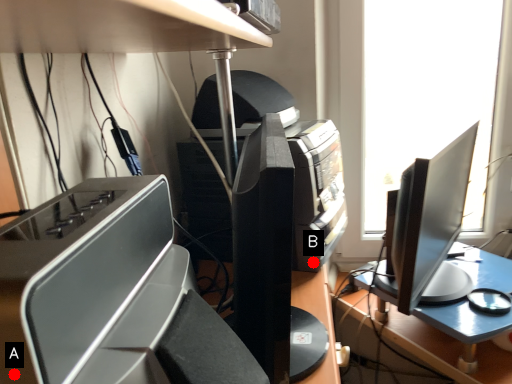
Question: Two points are circled on the image, labeled by A and B beside each circle. Which of the following is the farthest from the observer?

Choices:
 (A) A is further
 (B) B is further

Answer: (B)